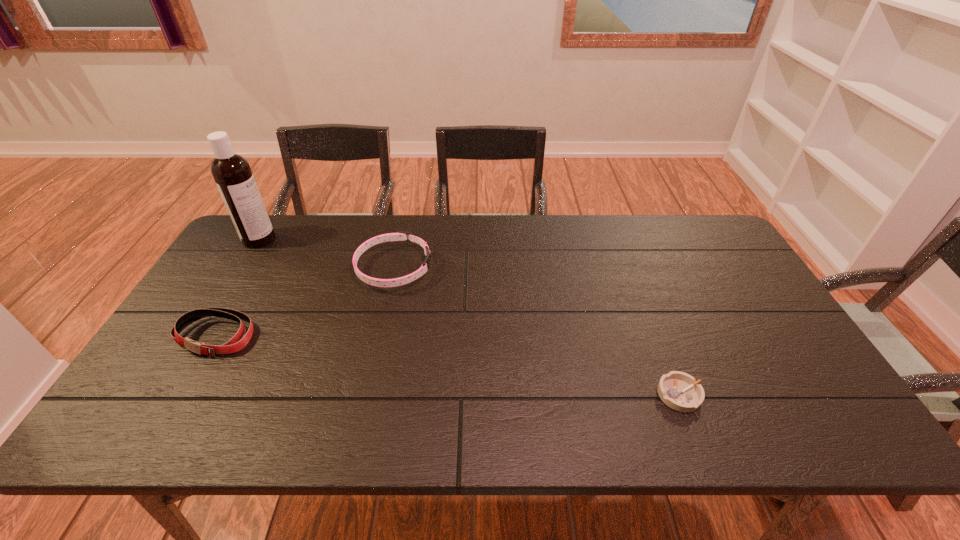
I want to click on vacant position in the image that satisfies the following two spatial constraints: 1. on the label side of the tallest object; 2. on the right side of the third farthest object, so click(x=200, y=336).